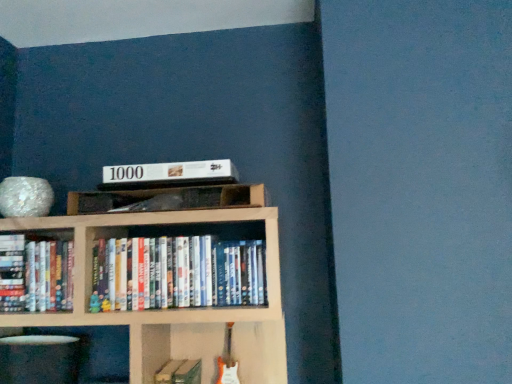
Question: From the image's perspective, is hardcover books at left, placed as the third book when sorted from right to left, below white glossy dvds at center, the 1th book when ordered from right to left?

Choices:
 (A) no
 (B) yes

Answer: (B)

Question: Would you say hardcover books at left, placed as the third book when sorted from right to left, is outside white glossy dvds at center, the first book from the top?

Choices:
 (A) yes
 (B) no

Answer: (A)

Question: Is hardcover books at left, positioned as the second book in bottom-to-top order, placed right next to white glossy dvds at center, the 1th book when ordered from right to left?

Choices:
 (A) yes
 (B) no

Answer: (B)

Question: Considering the relative sizes of hardcover books at left, the 2th book in the top-to-bottom sequence, and white glossy dvds at center, arranged as the 3th book when ordered from the bottom, in the image provided, is hardcover books at left, the 2th book in the top-to-bottom sequence, thinner than white glossy dvds at center, arranged as the 3th book when ordered from the bottom,?

Choices:
 (A) no
 (B) yes

Answer: (A)

Question: From the image's perspective, is hardcover books at left, positioned as the 1th book in left-to-right order, over white glossy dvds at center, the first book from the top?

Choices:
 (A) no
 (B) yes

Answer: (A)

Question: Is hardcover book at center, which appears as the 2th book when viewed from the left, wider or thinner than white glossy dvds at center, the 1th book when ordered from right to left?

Choices:
 (A) thin
 (B) wide

Answer: (B)

Question: From the image's perspective, is hardcover book at center, marked as the 3th book in a top-to-bottom arrangement, positioned above or below white glossy dvds at center, positioned as the third book in left-to-right order?

Choices:
 (A) above
 (B) below

Answer: (B)

Question: Considering the positions of hardcover book at center, which appears as the 2th book when viewed from the left, and white glossy dvds at center, positioned as the third book in left-to-right order, in the image, is hardcover book at center, which appears as the 2th book when viewed from the left, taller or shorter than white glossy dvds at center, positioned as the third book in left-to-right order,?

Choices:
 (A) short
 (B) tall

Answer: (B)

Question: Is hardcover book at center, marked as the 3th book in a top-to-bottom arrangement, in front of or behind white glossy dvds at center, positioned as the third book in left-to-right order, in the image?

Choices:
 (A) front
 (B) behind

Answer: (B)

Question: In the image, is hardcover books at left, positioned as the 1th book in left-to-right order, positioned in front of or behind white matte book at upper center?

Choices:
 (A) behind
 (B) front

Answer: (A)

Question: Is point (30, 309) positioned closer to the camera than point (137, 167)?

Choices:
 (A) farther
 (B) closer

Answer: (B)

Question: Is hardcover books at left, the 2th book in the top-to-bottom sequence, to the left or to the right of white matte book at upper center in the image?

Choices:
 (A) left
 (B) right

Answer: (A)

Question: From a real-world perspective, relative to white matte book at upper center, is hardcover books at left, placed as the third book when sorted from right to left, vertically above or below?

Choices:
 (A) below
 (B) above

Answer: (A)

Question: Is white matte book at upper center inside the boundaries of hardcover book at center, which appears as the 1th book when ordered from the bottom, or outside?

Choices:
 (A) inside
 (B) outside

Answer: (B)

Question: From a real-world perspective, relative to hardcover book at center, acting as the second book starting from the right, is white matte book at upper center vertically above or below?

Choices:
 (A) below
 (B) above

Answer: (B)